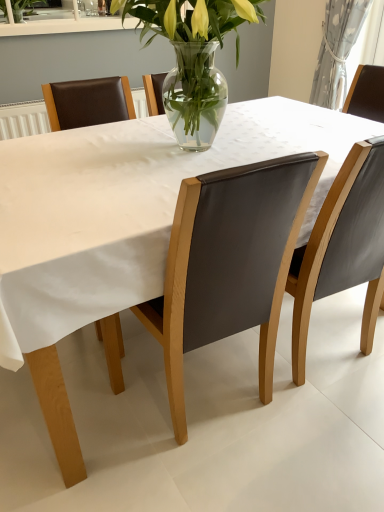
Locate an element on the screen. The image size is (384, 512). free space between leather at center, positioned as the first chair in left-to-right order, and matte gray chair at right, placed as the second chair when sorted from left to right is located at coordinates (283, 395).